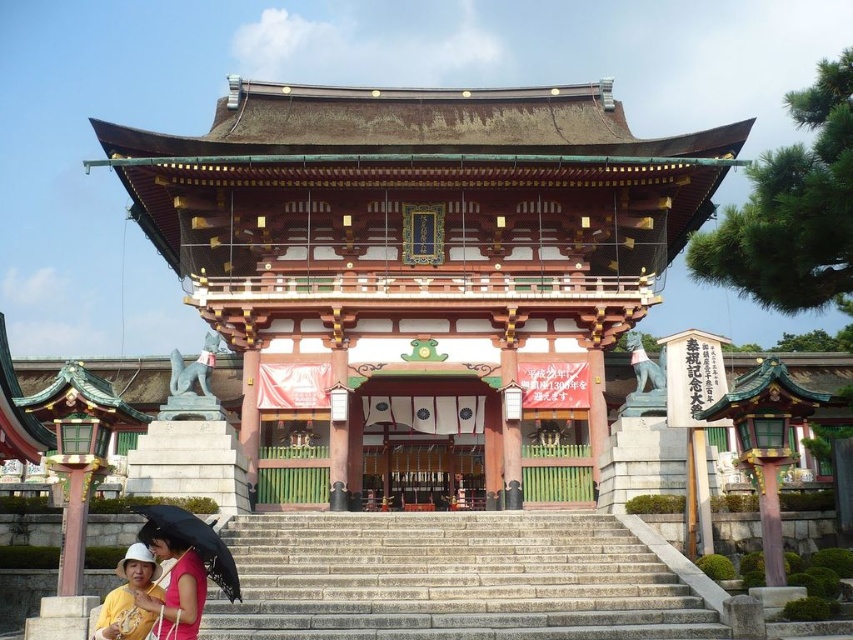
You are standing in front of a traditional Japanese shrine and notice a person wearing a matte yellow shirt at lower left and holding a black matte umbrella at lower left. From your perspective, which object is positioned more to the right side?

The matte yellow shirt at lower left is positioned to the right of the black matte umbrella at lower left, so the matte yellow shirt at lower left is more to the right side.

Looking at this image, you are standing at the entrance of the shrine and want to take a photo of the gray stone stairs at center and the black matte umbrella at lower left. Which object should you focus on first to ensure it appears larger in your photo?

The gray stone stairs at center should be focused on first because it is closer to the viewer than the black matte umbrella at lower left, making it appear larger when in focus.